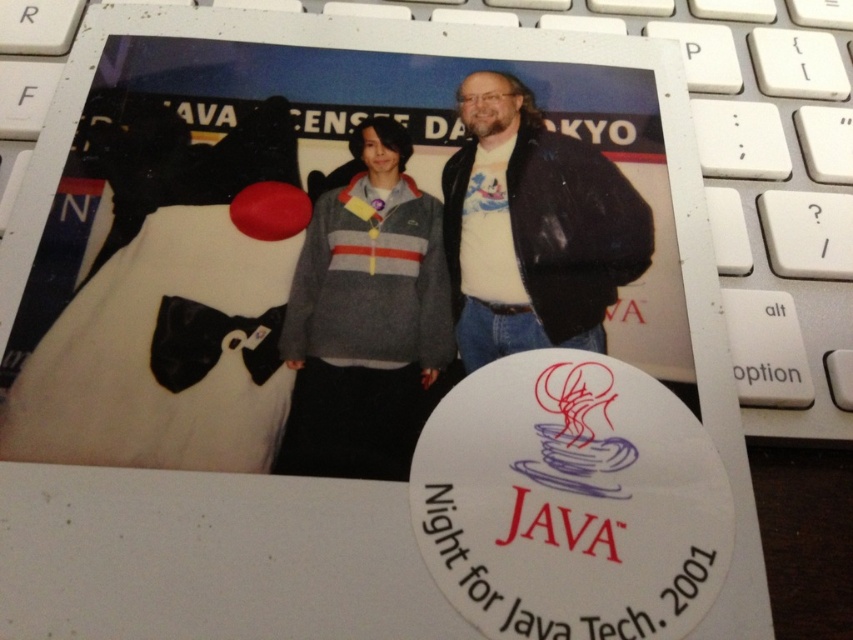
You are trying to place a new sticker exactly where the gray fleece sweater at center is located. What are the coordinates of the point where you should place the sticker?

The coordinates for the gray fleece sweater at center are at point (364, 317). You should place the sticker at those coordinates.

You are organizing a tech conference and need to display two items on a table. The gray fleece sweater at center and the matte black jacket at center must be placed side by side. If the table has limited space, which item should you place first to ensure both fit?

The gray fleece sweater at center should be placed first because its width is less than the matte black jacket at center, allowing more space for the wider jacket afterward.

From the picture: You have a white plastic laptop keyboard at center and a gray fleece sweater at center. Which object is wider?

The white plastic laptop keyboard at center is wider than the gray fleece sweater at center.